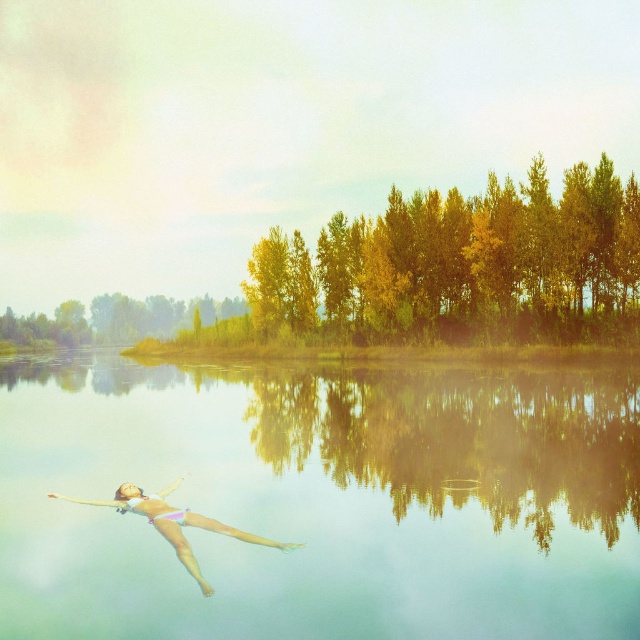
You are a swimmer planning to dive into the clear water at center. You notice the pink fabric bikini at lower left. Which object is wider in the image?

The clear water at center might be wider than pink fabric bikini at lower left.